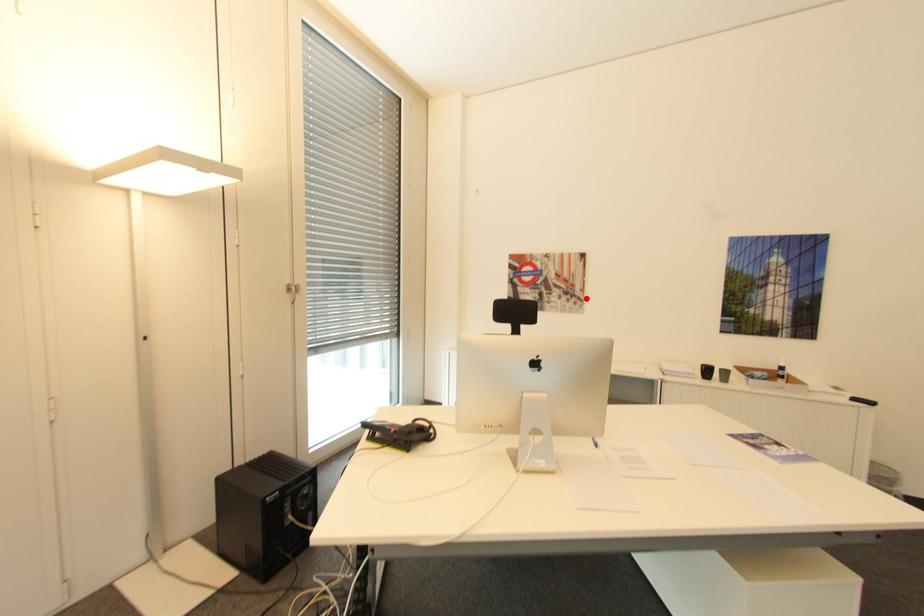
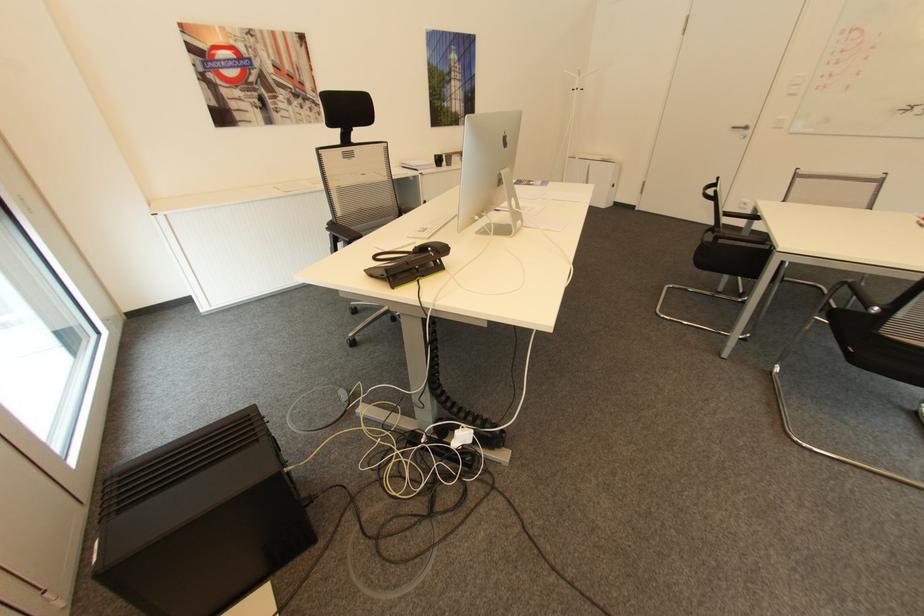
In the second image, find the point that corresponds to the highlighted location in the first image.

(322, 102)